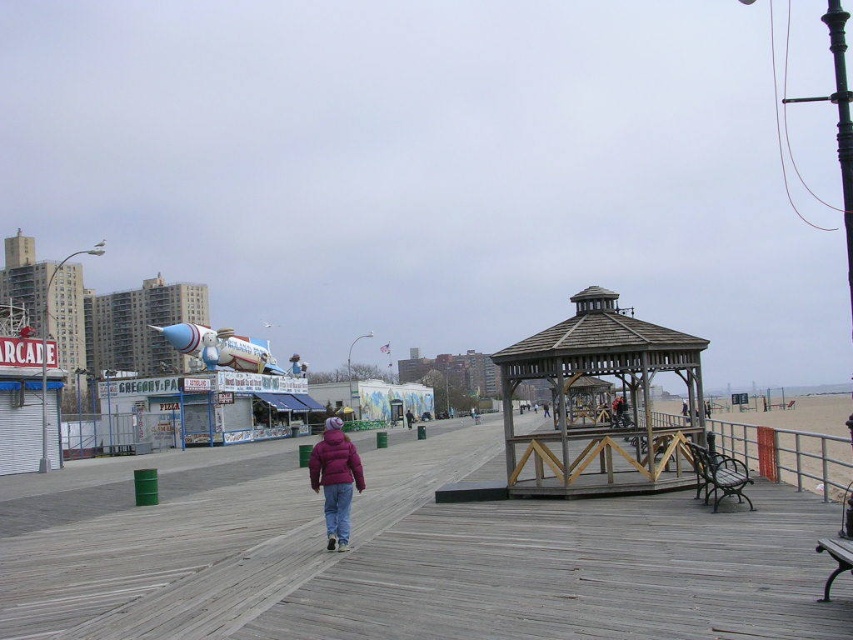
You are standing at the starting point of the boardwalk and want to reach the gazebo located at the point marked as point [335,464]. If your walking speed is 1.5 meters per second, how many seconds will it take you to reach the gazebo?

The point [335,464] is 17.37 meters away from the viewer. At a walking speed of 1.5 meters per second, it will take approximately 11.58 seconds to reach the gazebo. Since we usually round to the nearest whole number, it would take about 12 seconds.

From the picture: You are standing on the boardwalk and want to take a photo of both the wooden gazebo at center and the maroon puffy jacket at center. Since you can only focus on one object at a time, which one should you focus on first to ensure it appears sharp in the photo?

You should focus on the wooden gazebo at center first because it is closer to you than the maroon puffy jacket at center, so focusing on the closer object will keep it sharp while the background may blur slightly.